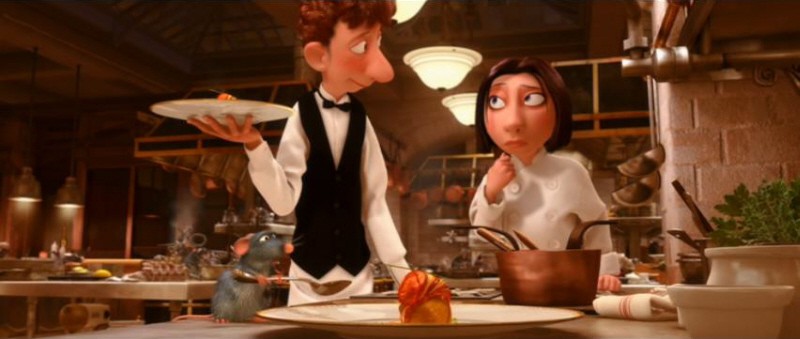
The width and height of the screenshot is (800, 339). In order to click on pot in this screenshot , I will do `click(546, 272)`.